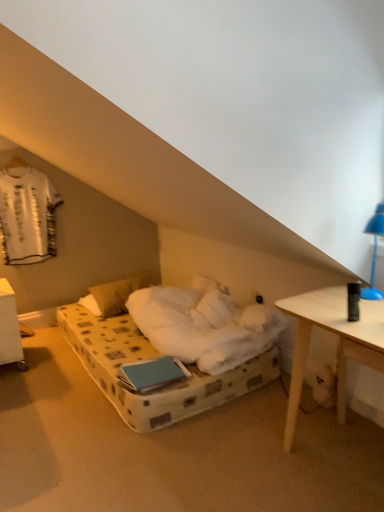
Question: Could you tell me if white plastic nightstand at lower left is turned towards white fabric shirt at upper left?

Choices:
 (A) no
 (B) yes

Answer: (A)

Question: Is white plastic nightstand at lower left not within white fabric shirt at upper left?

Choices:
 (A) yes
 (B) no

Answer: (A)

Question: Are white plastic nightstand at lower left and white fabric shirt at upper left making contact?

Choices:
 (A) no
 (B) yes

Answer: (A)

Question: Does white plastic nightstand at lower left have a lesser height compared to white fabric shirt at upper left?

Choices:
 (A) yes
 (B) no

Answer: (A)

Question: From a real-world perspective, is white plastic nightstand at lower left positioned over white fabric shirt at upper left based on gravity?

Choices:
 (A) yes
 (B) no

Answer: (B)

Question: From a real-world perspective, relative to white soft pillow at center, is white fabric shirt at upper left vertically above or below?

Choices:
 (A) above
 (B) below

Answer: (A)

Question: Which is correct: white fabric shirt at upper left is inside white soft pillow at center, or outside of it?

Choices:
 (A) inside
 (B) outside

Answer: (B)

Question: Is white fabric shirt at upper left in front of or behind white soft pillow at center in the image?

Choices:
 (A) behind
 (B) front

Answer: (B)

Question: Considering the positions of point (6, 214) and point (124, 286), is point (6, 214) closer or farther from the camera than point (124, 286)?

Choices:
 (A) farther
 (B) closer

Answer: (B)

Question: Is white plastic nightstand at lower left in front of or behind blue plastic lamp at upper right in the image?

Choices:
 (A) front
 (B) behind

Answer: (B)

Question: In terms of height, does white plastic nightstand at lower left look taller or shorter compared to blue plastic lamp at upper right?

Choices:
 (A) short
 (B) tall

Answer: (B)

Question: From the image's perspective, is white plastic nightstand at lower left located above or below blue plastic lamp at upper right?

Choices:
 (A) above
 (B) below

Answer: (B)

Question: From a real-world perspective, is white plastic nightstand at lower left above or below blue plastic lamp at upper right?

Choices:
 (A) below
 (B) above

Answer: (A)

Question: In terms of size, does blue plastic lamp at upper right appear bigger or smaller than white soft pillow at center?

Choices:
 (A) small
 (B) big

Answer: (A)

Question: Based on their positions, is blue plastic lamp at upper right located to the left or right of white soft pillow at center?

Choices:
 (A) right
 (B) left

Answer: (A)